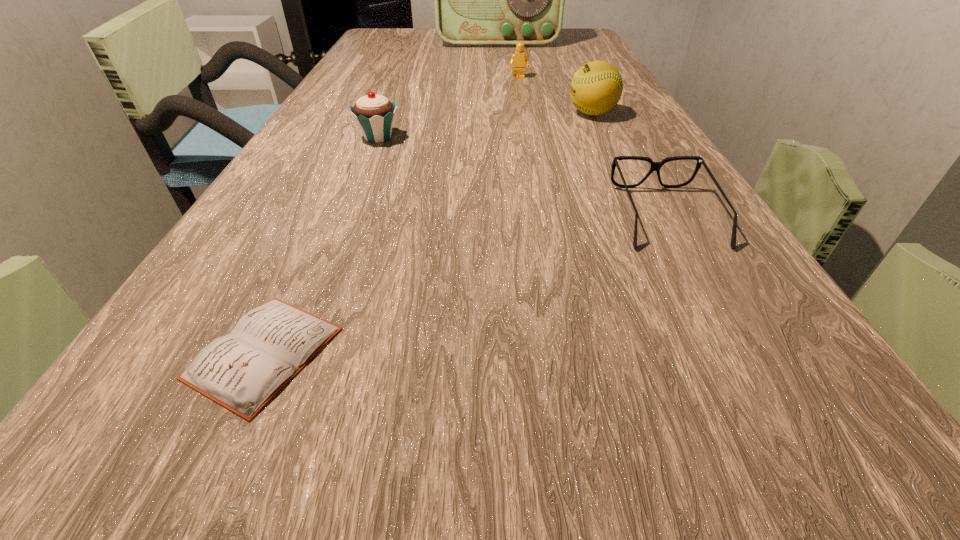
Find the location of a particular element. Image resolution: width=960 pixels, height=540 pixels. vacant area that lies between the tallest object and the Lego is located at coordinates (508, 60).

The width and height of the screenshot is (960, 540). In order to click on vacant area between the fifth nearest object and the cupcake in this screenshot , I will do `click(448, 107)`.

The width and height of the screenshot is (960, 540). Identify the location of empty space between the diary and the spectacles. (465, 285).

This screenshot has height=540, width=960. I want to click on free space between the softball and the diary, so click(428, 233).

The height and width of the screenshot is (540, 960). What are the coordinates of `unoccupied area between the spectacles and the farthest object` in the screenshot? It's located at (582, 129).

Locate an element on the screen. This screenshot has width=960, height=540. free area in between the fifth farthest object and the Lego is located at coordinates (592, 147).

This screenshot has width=960, height=540. In order to click on empty space between the second farthest object and the fifth tallest object in this screenshot , I will do `click(592, 147)`.

Select which object appears as the fourth closest to the tallest object. Please provide its 2D coordinates. Your answer should be formatted as a tuple, i.e. [(x, y)], where the tuple contains the x and y coordinates of a point satisfying the conditions above.

[(655, 166)]

Locate which object is the fifth closest to the Lego. Please provide its 2D coordinates. Your answer should be formatted as a tuple, i.e. [(x, y)], where the tuple contains the x and y coordinates of a point satisfying the conditions above.

[(241, 371)]